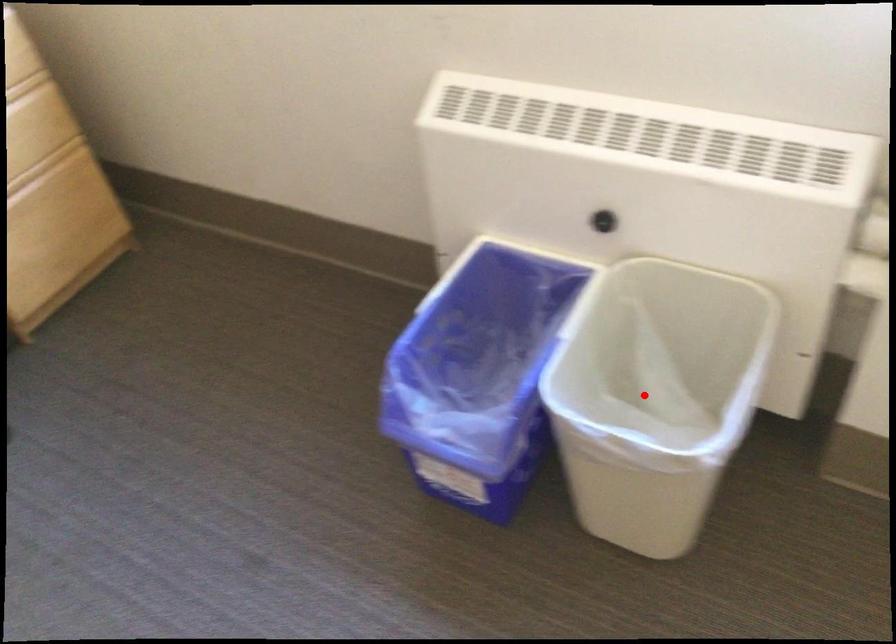
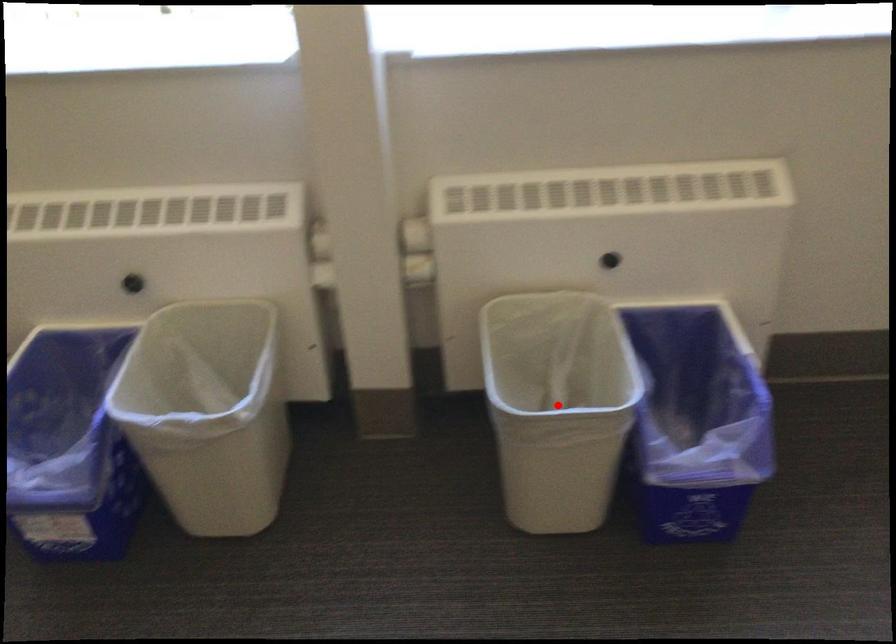
I am providing you with two images of the same scene from different viewpoints. A red point is marked on the first image and another point is marked on the second image. Is the red point in image1 aligned with the point shown in image2?

No